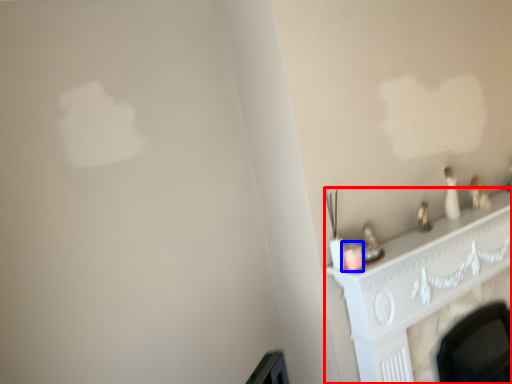
Question: Which object is closer to the camera taking this photo, fireplace (highlighted by a red box) or candle holder (highlighted by a blue box)?

Choices:
 (A) fireplace
 (B) candle holder

Answer: (B)